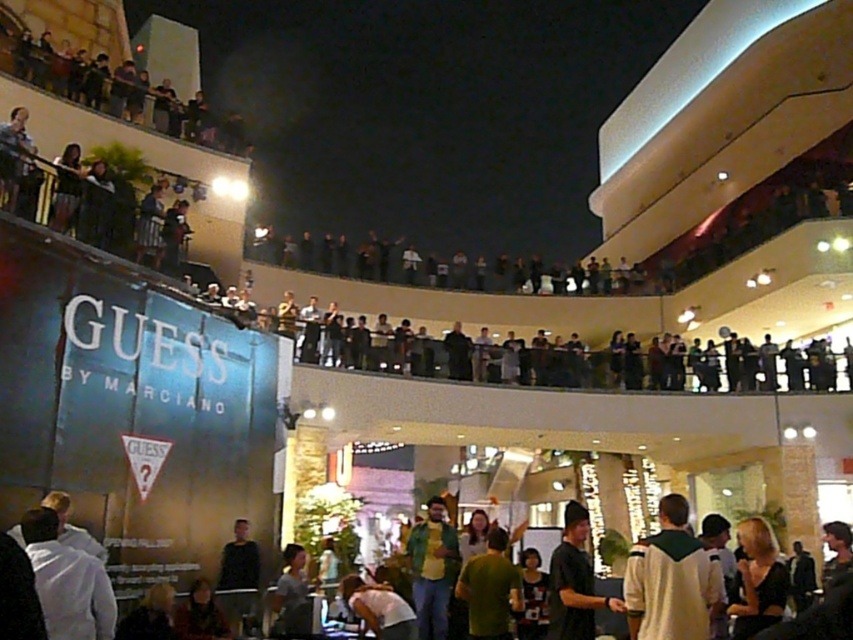
You are a customer in the mall and see the white matte jacket at lower left. Where exactly is it located in the image?

The white matte jacket at lower left is located at point (67, 580) in the image.

Consider the image. You are a store clerk who needs to pack two items for a customer. The items are the white matte jacket at lower left and the green matte shirt at center. The customer has a bag that can only hold items that are not thicker than 3 inches. Which item is more likely to fit in the bag?

The white matte jacket at lower left is thinner than the green matte shirt at center, so the white matte jacket at lower left is more likely to fit in the bag since it is thinner and meets the 3 inches thickness requirement.

You are a store manager who wants to display the white matte jacket at lower left and the green shirt at center on a mannequin. Which one requires a narrower hanger?

The white matte jacket at lower left is thinner than the green shirt at center, so it requires a narrower hanger.